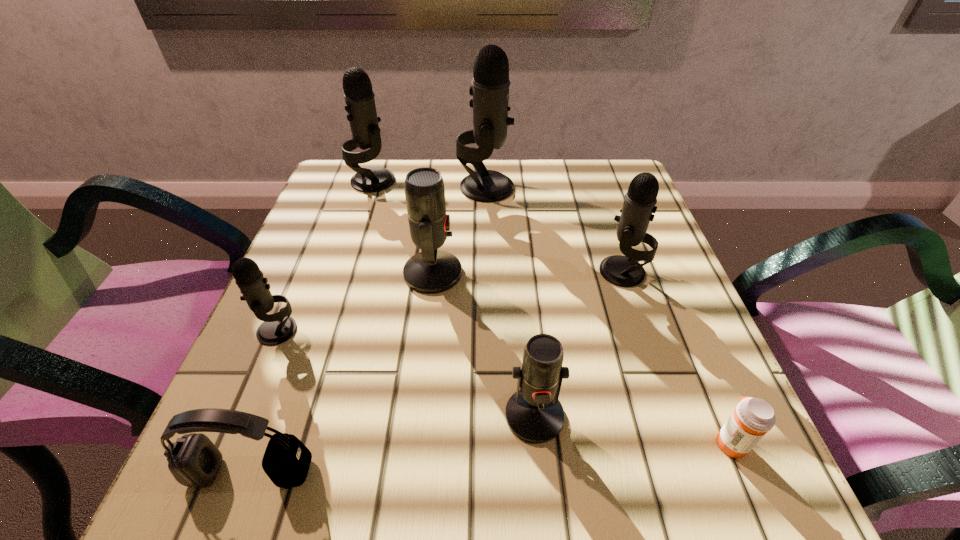
In the image, there is a desktop. Identify the location of vacant region at the far edge. The image size is (960, 540). [541, 172].

Locate an element on the screen. vacant space at the left edge of the desktop is located at coordinates (378, 218).

In the image, there is a desktop. Find the location of `vacant space at the right edge`. vacant space at the right edge is located at coordinates (608, 306).

This screenshot has height=540, width=960. Find the location of `vacant point at the far left corner`. vacant point at the far left corner is located at coordinates (328, 199).

Locate an element on the screen. free space at the far right corner of the desktop is located at coordinates (615, 183).

In the image, there is a desktop. Where is `vacant space at the near right corner`? vacant space at the near right corner is located at coordinates (766, 497).

What are the coordinates of `free spot between the farther red microphone and the second object from right to left` in the screenshot? It's located at (528, 272).

Where is `free point between the seventh shortest object and the smaller red microphone`? This screenshot has width=960, height=540. free point between the seventh shortest object and the smaller red microphone is located at coordinates (454, 298).

Locate an element on the screen. empty space that is in between the smallest black microphone and the second tallest object is located at coordinates (325, 255).

Where is `free space between the fifth farthest microphone and the bigger red microphone`? free space between the fifth farthest microphone and the bigger red microphone is located at coordinates (355, 302).